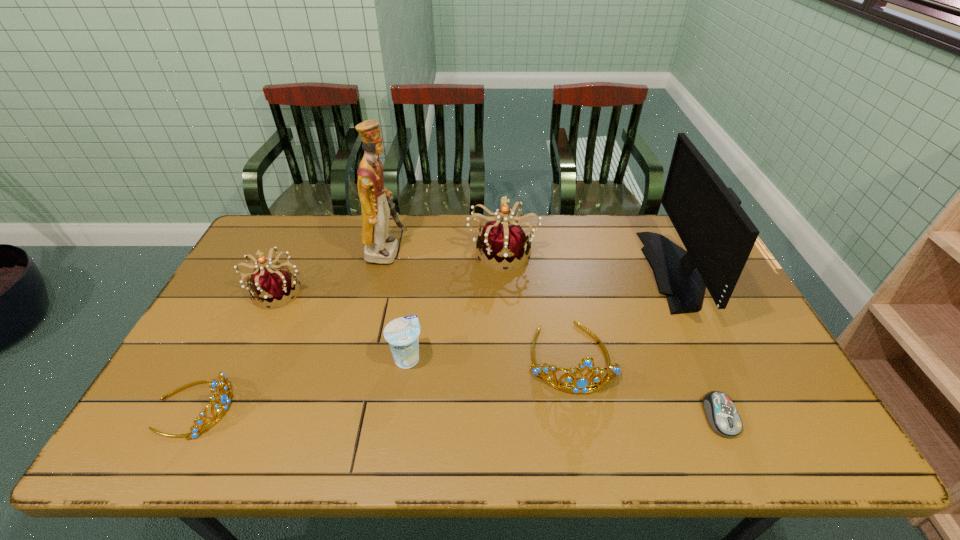
Identify which tiara is the closest to the yogurt. Please provide its 2D coordinates. Your answer should be formatted as a tuple, i.e. [(x, y)], where the tuple contains the x and y coordinates of a point satisfying the conditions above.

[(582, 384)]

Select which tiara is the closest to the third tallest object. Please provide its 2D coordinates. Your answer should be formatted as a tuple, i.e. [(x, y)], where the tuple contains the x and y coordinates of a point satisfying the conditions above.

[(582, 384)]

At what (x,y) coordinates should I click in order to perform the action: click on vacant space that satisfies the following two spatial constraints: 1. on the front-facing side of the bigger red tiara; 2. on the front-facing side of the smaller gold tiara. Please return your answer as a coordinate pair (x, y). This screenshot has width=960, height=540. Looking at the image, I should click on (512, 407).